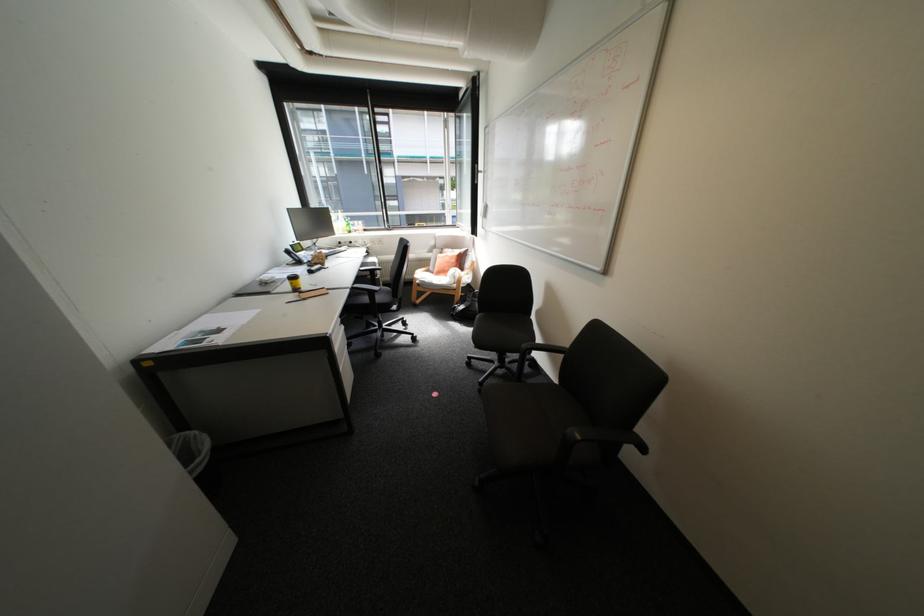
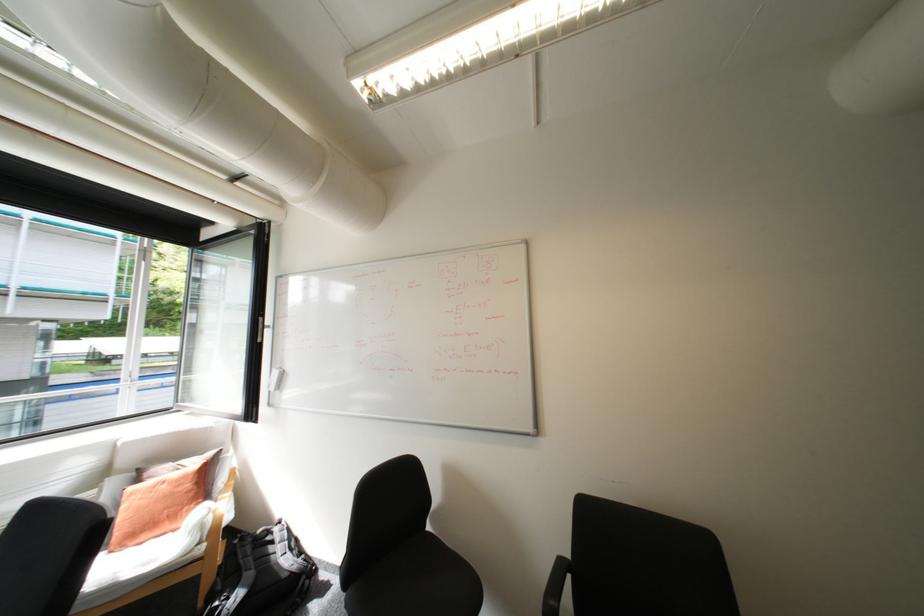
First-person continuous shooting, in which direction is the camera rotating?

The rotation direction of the camera is right-up.